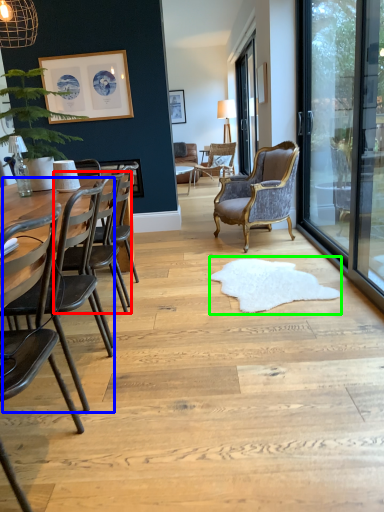
Question: Which is farther away from chair (highlighted by a red box)? swivel chair (highlighted by a blue box) or mat (highlighted by a green box)?

Choices:
 (A) swivel chair
 (B) mat

Answer: (B)